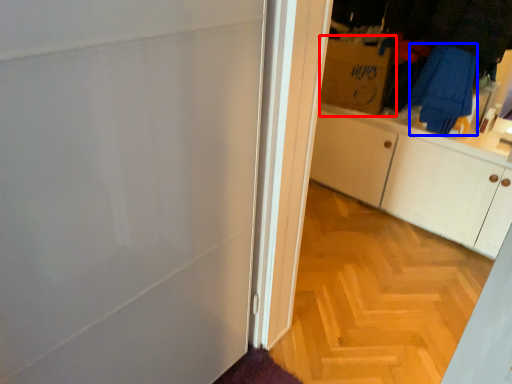
Question: Among these objects, which one is farthest to the camera, cardboard box (highlighted by a red box) or laundry (highlighted by a blue box)?

Choices:
 (A) cardboard box
 (B) laundry

Answer: (A)